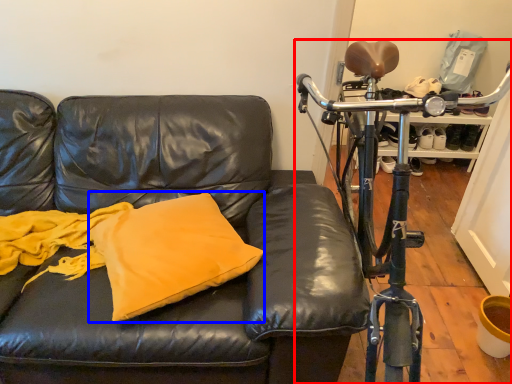
Question: Which object appears closest to the camera in this image, bicycle (highlighted by a red box) or pillow (highlighted by a blue box)?

Choices:
 (A) bicycle
 (B) pillow

Answer: (A)